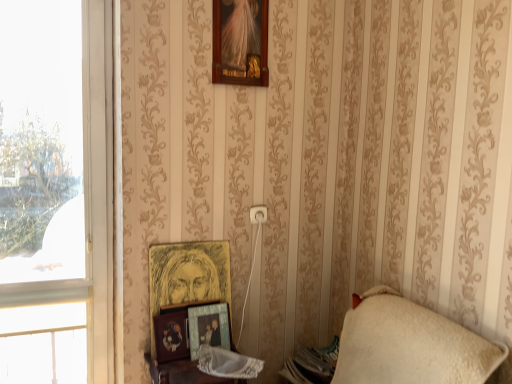
Question: Based on their sizes in the image, would you say metallic silver frame at lower center, positioned as the 1th picture frame in bottom-to-top order, is bigger or smaller than wooden photo frame at lower center, which is the 2th picture frame from bottom to top?

Choices:
 (A) big
 (B) small

Answer: (A)

Question: Is metallic silver frame at lower center, positioned as the 1th picture frame in bottom-to-top order, to the left or to the right of wooden photo frame at lower center, marked as the third picture frame in a top-to-bottom arrangement, in the image?

Choices:
 (A) right
 (B) left

Answer: (A)

Question: Considering the real-world distances, which object is closest to the wooden table at lower center?

Choices:
 (A) transparent glass window at left, the first window from the top
 (B) gold textured frame at center, the third picture frame ordered from the bottom
 (C) white fabric window at left, the 1th window from the bottom
 (D) wooden photo frame at lower center, which is the 2th picture frame from bottom to top
 (E) metallic silver frame at lower center, positioned as the 1th picture frame in bottom-to-top order

Answer: (D)

Question: Which object is positioned farthest from the wooden photo frame at lower center, marked as the third picture frame in a top-to-bottom arrangement?

Choices:
 (A) metallic silver frame at lower center, positioned as the 1th picture frame in bottom-to-top order
 (B) white fabric window at left, the 1th window from the bottom
 (C) wooden frame at upper center, the 4th picture frame when ordered from bottom to top
 (D) transparent glass window at left, the 2th window in the bottom-to-top sequence
 (E) wooden table at lower center

Answer: (C)